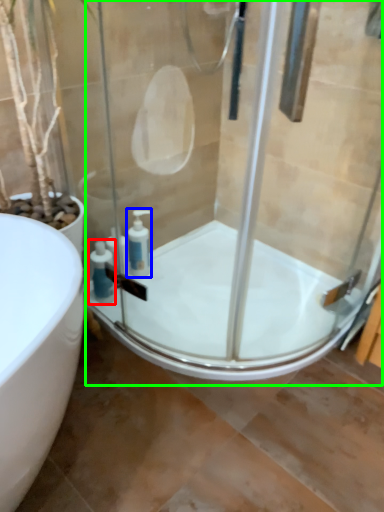
Question: Which object is positioned farthest from soap dispenser (highlighted by a red box)? Select from soap dispenser (highlighted by a blue box) and shower door (highlighted by a green box).

Choices:
 (A) soap dispenser
 (B) shower door

Answer: (B)